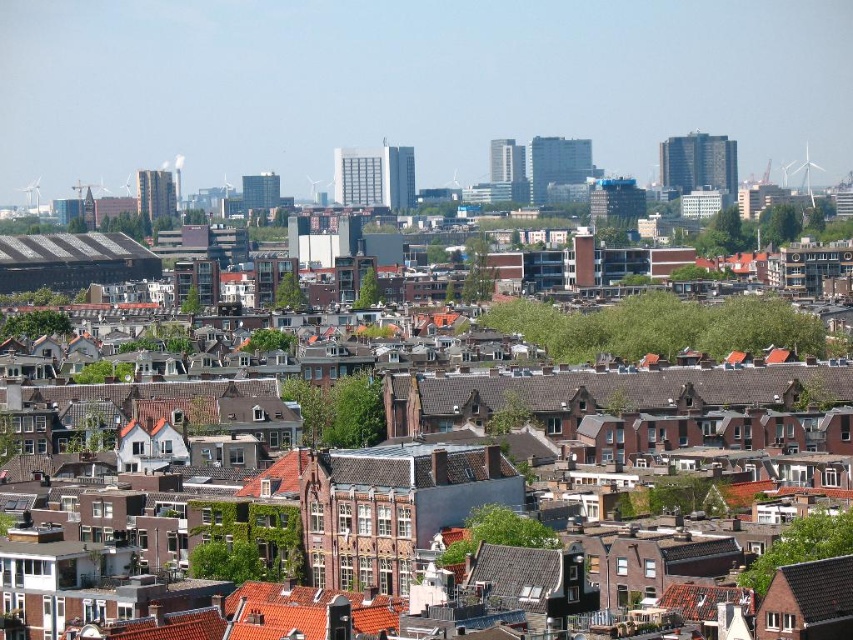
Between white plastic wind turbine at upper right and white plastic wind turbine at upper left, which one appears on the right side from the viewer's perspective?

Positioned to the right is white plastic wind turbine at upper right.

Is white plastic wind turbine at upper right positioned behind white plastic wind turbine at upper left?

No, white plastic wind turbine at upper right is closer to the viewer.

Is point (798, 168) farther from viewer compared to point (39, 196)?

No.

You are a GUI agent. You are given a task and a screenshot of the screen. Output one action in this format:
    pyautogui.click(x=<x>, y=<y>)
    Task: Click on the white plastic wind turbine at upper right
    
    Given the screenshot: What is the action you would take?
    pyautogui.click(x=808, y=172)

Is white plastic wind turbine at upper right positioned behind white plastic wind turbine at center?

No, white plastic wind turbine at upper right is closer to the viewer.

Measure the distance between point (807, 148) and camera.

Point (807, 148) and camera are 474.85 meters apart from each other.

The height and width of the screenshot is (640, 853). What are the coordinates of `white plastic wind turbine at upper right` in the screenshot? It's located at (808, 172).

Does point (318, 196) lie behind point (28, 192)?

No, (318, 196) is closer to viewer.

Who is more forward, (309, 189) or (35, 198)?

Point (309, 189)

Is point (323, 189) more distant than point (27, 202)?

That is False.

Where is `white plastic wind turbine at center`? The height and width of the screenshot is (640, 853). white plastic wind turbine at center is located at coordinates (318, 189).